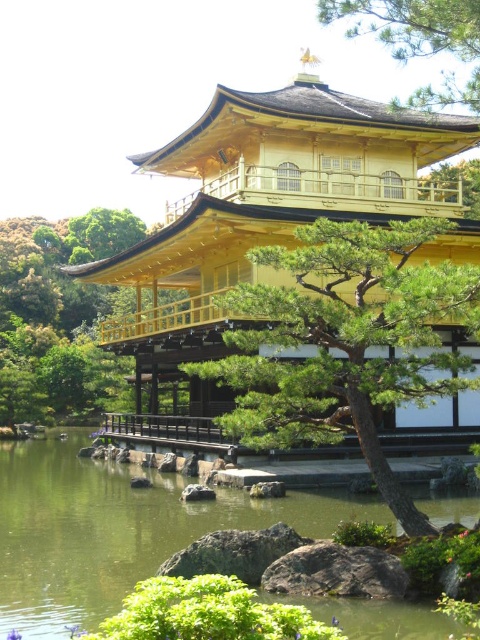
Who is lower down, gold polished wood palace at center or green liquid water at center?

green liquid water at center is below.

Does gold polished wood palace at center have a greater width compared to green liquid water at center?

Yes.

The width and height of the screenshot is (480, 640). Find the location of `gold polished wood palace at center`. gold polished wood palace at center is located at coordinates (272, 204).

Who is positioned more to the right, green textured tree at upper center or green matte tree at upper right?

green matte tree at upper right

Is green textured tree at upper center thinner than green matte tree at upper right?

Correct, green textured tree at upper center's width is less than green matte tree at upper right's.

Is point (458, 33) closer to camera compared to point (470, 193)?

That is True.

Locate an element on the screen. The image size is (480, 640). green textured tree at upper center is located at coordinates (420, 38).

Who is more distant from viewer, (316, 282) or (314, 600)?

The point (316, 282) is behind.

This screenshot has height=640, width=480. Find the location of `green textured tree at center`. green textured tree at center is located at coordinates (344, 340).